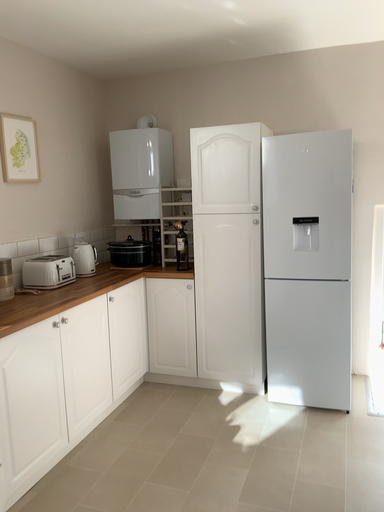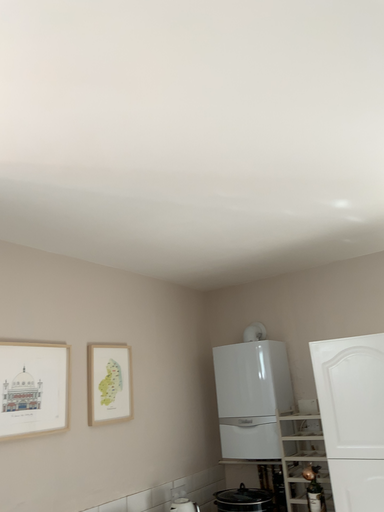
Question: How did the camera likely rotate when shooting the video?

Choices:
 (A) rotated downward
 (B) rotated upward

Answer: (B)